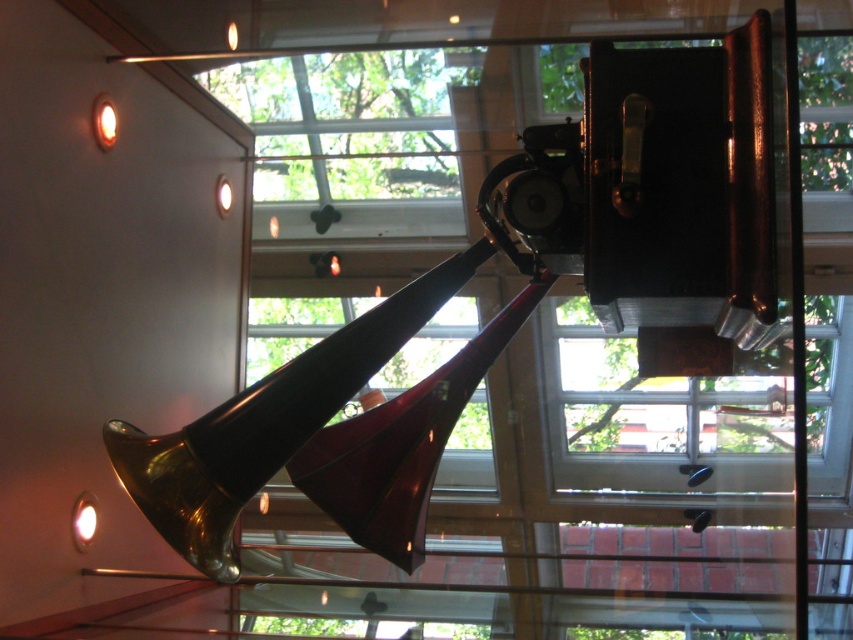
Question: Which object is positioned closest to the shiny brass trumpet at center?

Choices:
 (A) matte gold lamp at upper left
 (B) matte gold lamp at upper center

Answer: (A)

Question: Which object is closer to the camera taking this photo?

Choices:
 (A) matte gold lamp at lower left
 (B) matte gold lamp at upper left
 (C) transparent glass window at center

Answer: (A)

Question: Is transparent glass window at center to the left of matte gold lamp at upper left from the viewer's perspective?

Choices:
 (A) no
 (B) yes

Answer: (A)

Question: Which of the following is the farthest from the observer?

Choices:
 (A) click(96, 516)
 (B) click(334, 312)
 (C) click(216, 186)

Answer: (B)

Question: Does transparent glass window at upper center have a greater width compared to matte gold lamp at upper center?

Choices:
 (A) yes
 (B) no

Answer: (A)

Question: Does transparent glass window at upper center come in front of shiny brass trumpet at center?

Choices:
 (A) yes
 (B) no

Answer: (A)